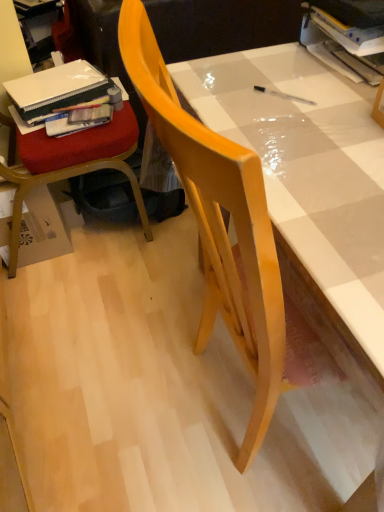
Question: From the image's perspective, is wooden chair at left, which appears as the 2th chair when viewed from the right, above matte plastic book at upper right, arranged as the 1th book when viewed from the front?

Choices:
 (A) no
 (B) yes

Answer: (A)

Question: Are wooden chair at left, the first chair viewed from the left, and matte plastic book at upper right, the 3th book in the back-to-front sequence, beside each other?

Choices:
 (A) yes
 (B) no

Answer: (B)

Question: Can you confirm if wooden chair at left, which appears as the 2th chair when viewed from the right, is bigger than matte plastic book at upper right, the 3th book in the back-to-front sequence?

Choices:
 (A) no
 (B) yes

Answer: (B)

Question: Is wooden chair at left, which appears as the 2th chair when viewed from the right, shorter than matte plastic book at upper right, the 1th book when ordered from right to left?

Choices:
 (A) no
 (B) yes

Answer: (A)

Question: Is wooden chair at left, which appears as the 2th chair when viewed from the right, to the left of matte plastic book at upper right, which is the third book in left-to-right order, from the viewer's perspective?

Choices:
 (A) yes
 (B) no

Answer: (A)

Question: Is wooden chair at left, the first chair viewed from the left, positioned in front of matte plastic book at upper right, the 1th book when ordered from right to left?

Choices:
 (A) no
 (B) yes

Answer: (A)

Question: From the image's perspective, is matte plastic book at left, the 2th book from the left, beneath wooden chair at left, which appears as the 2th chair when viewed from the right?

Choices:
 (A) yes
 (B) no

Answer: (B)

Question: Is matte plastic book at left, the 2th book positioned from the front, positioned far away from wooden chair at left, the first chair viewed from the left?

Choices:
 (A) yes
 (B) no

Answer: (B)

Question: Does matte plastic book at left, the 2th book from the left, appear on the left side of wooden chair at left, the first chair viewed from the left?

Choices:
 (A) no
 (B) yes

Answer: (A)

Question: Can you confirm if matte plastic book at left, positioned as the second book in back-to-front order, is bigger than wooden chair at left, which appears as the 2th chair when viewed from the right?

Choices:
 (A) yes
 (B) no

Answer: (B)

Question: From a real-world perspective, is matte plastic book at left, the 2th book from the left, beneath wooden chair at left, which appears as the 2th chair when viewed from the right?

Choices:
 (A) yes
 (B) no

Answer: (B)

Question: Does matte plastic book at left, which ranks as the 2th book in right-to-left order, have a lesser width compared to wooden chair at left, which appears as the 2th chair when viewed from the right?

Choices:
 (A) no
 (B) yes

Answer: (B)

Question: Considering the relative sizes of wooden chair at left, which appears as the 2th chair when viewed from the right, and matte white table at center in the image provided, is wooden chair at left, which appears as the 2th chair when viewed from the right, thinner than matte white table at center?

Choices:
 (A) yes
 (B) no

Answer: (A)